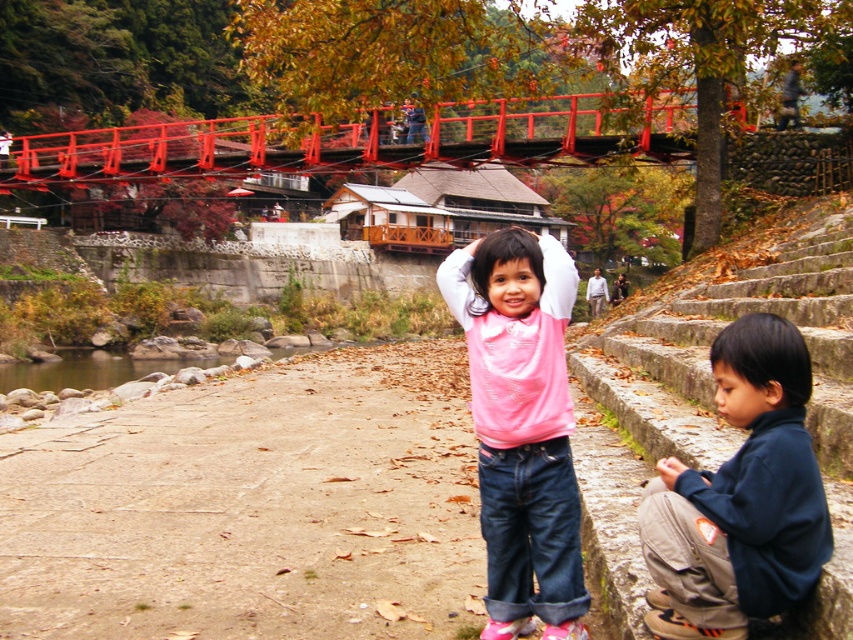
Question: Which of the following is the farthest from the observer?

Choices:
 (A) (741, 580)
 (B) (570, 259)
 (C) (358, 156)

Answer: (C)

Question: Is pink matte shirt at center smaller than metallic red bridge at upper center?

Choices:
 (A) yes
 (B) no

Answer: (A)

Question: Among these objects, which one is nearest to the camera?

Choices:
 (A) metallic red bridge at upper center
 (B) dark blue fleece jacket at lower right
 (C) pink matte shirt at center

Answer: (B)

Question: Is dark blue fleece jacket at lower right below metallic red bridge at upper center?

Choices:
 (A) yes
 (B) no

Answer: (A)

Question: Can you confirm if pink matte shirt at center is positioned to the right of metallic red bridge at upper center?

Choices:
 (A) no
 (B) yes

Answer: (B)

Question: Among these points, which one is nearest to the camera?

Choices:
 (A) (515, 112)
 (B) (566, 497)

Answer: (B)